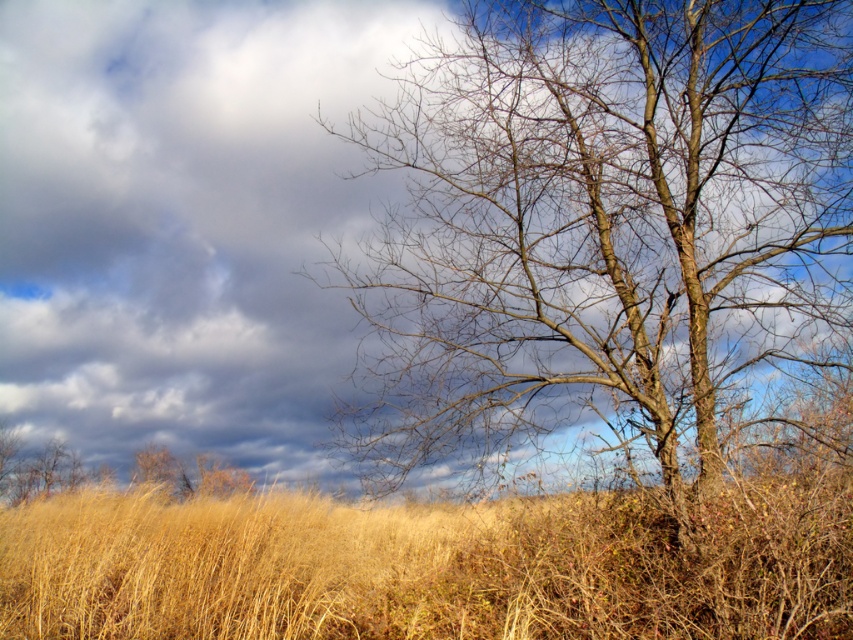
Question: Which object appears closest to the camera in this image?

Choices:
 (A) bark textured tree at right
 (B) dry grass at center

Answer: (B)

Question: Which point is closer to the camera?

Choices:
 (A) (541, 16)
 (B) (219, 625)

Answer: (A)

Question: Which of the following is the closest to the observer?

Choices:
 (A) click(772, 93)
 (B) click(366, 625)

Answer: (A)

Question: Is the position of bark textured tree at right less distant than that of dry grass at center?

Choices:
 (A) no
 (B) yes

Answer: (A)

Question: Does bark textured tree at right come behind dry grass at center?

Choices:
 (A) no
 (B) yes

Answer: (B)

Question: Is bark textured tree at right in front of dry grass at center?

Choices:
 (A) no
 (B) yes

Answer: (A)